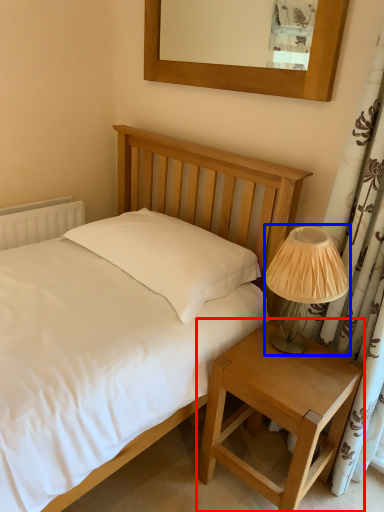
Question: Among these objects, which one is nearest to the camera, nightstand (highlighted by a red box) or table lamp (highlighted by a blue box)?

Choices:
 (A) nightstand
 (B) table lamp

Answer: (A)